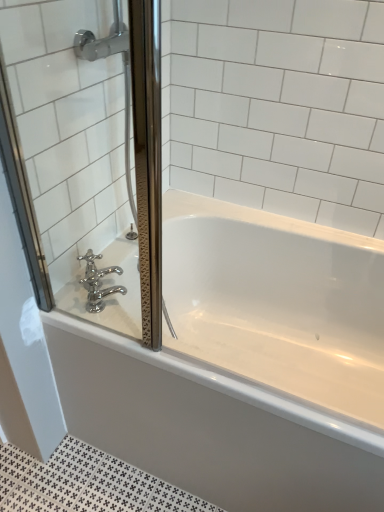
The height and width of the screenshot is (512, 384). I want to click on free space to the back side of polished chrome faucet at lower left, so click(117, 272).